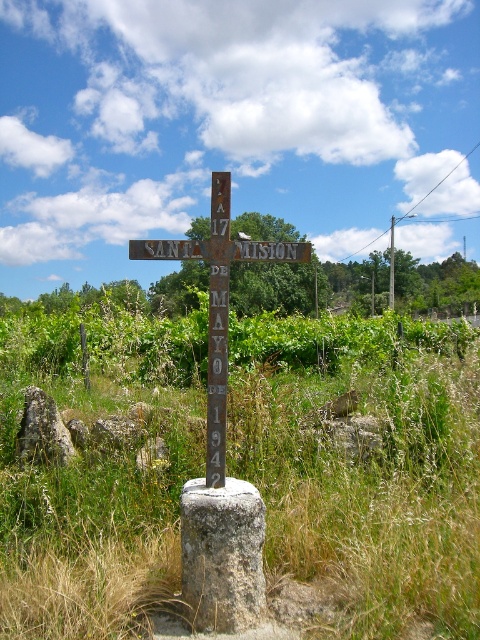
You are a landscape photographer planning to capture the rusty metal cross at center and the brown wooden pole at center in a single frame. Given their sizes, which object should you focus on to ensure both are visible without cropping?

The rusty metal cross at center occupies less space than the brown wooden pole at center, so you should focus on the brown wooden pole at center to ensure both are visible without cropping.

Looking at this image, you are a farmer who wants to replace the rusty metal cross at center with a new one that matches the brown wooden pole at center in width. What should you do?

The rusty metal cross at center is narrower than the brown wooden pole at center. To match the width, you should choose a new cross that is wider than the current one.